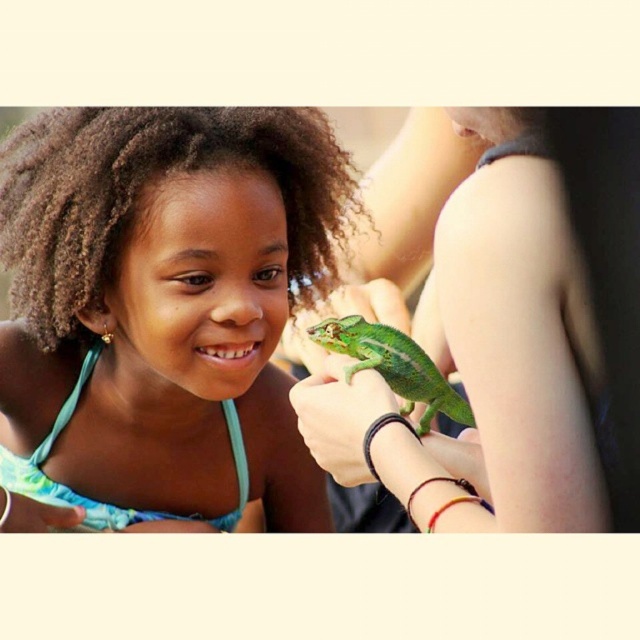
Wait, the objects list has two entries that look the same but with slightly different wording. How should I handle this? The first is matte green chameleon at center and the second is green matte chameleon at center. They are essentially the same except the order of adjectives. Should I treat them as separate objects even though they refer to the same chameleon? The description says the first is to the left of the second. But since they are the same chameleon, this might be an error. Maybe it should be two?

The system might have a typo, but follow the given input. Treat them as two separate objects even if they seem identical. Use the descriptions provided to form the question and answer accordingly.

Based on the photo, you are a photographer taking a picture of the scene. You notice two points in the image at coordinates point (x=38, y=419) and point (x=328, y=460). Which point is closer to your camera?

Point (x=38, y=419) is further to the camera than point (x=328, y=460). Therefore, point (x=328, y=460) is closer to the camera.

You are a zookeeper trying to determine which animal is larger between the matte green chameleon at center and the green scaly lizard at center. Based on the image, which one is wider?

The matte green chameleon at center might be wider than green scaly lizard at center according to the image description.